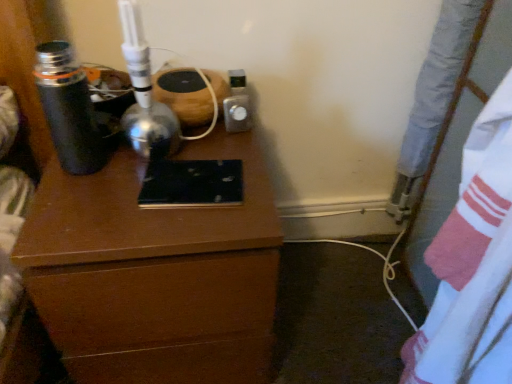
Locate an element on the screen. Image resolution: width=512 pixels, height=384 pixels. free location in front of metallic silver thermos at left is located at coordinates (81, 205).